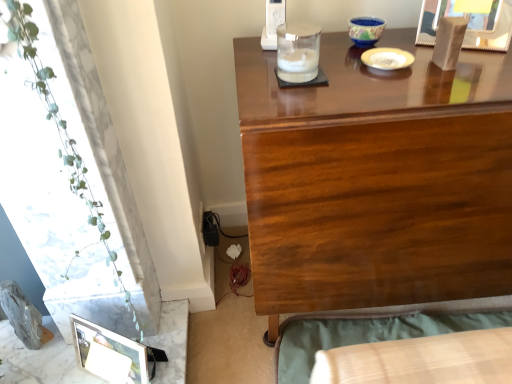
Locate an element on the screen. The image size is (512, 384). vacant space in front of wooden picture frame at upper right, placed as the 1th picture frame when sorted from right to left is located at coordinates (472, 62).